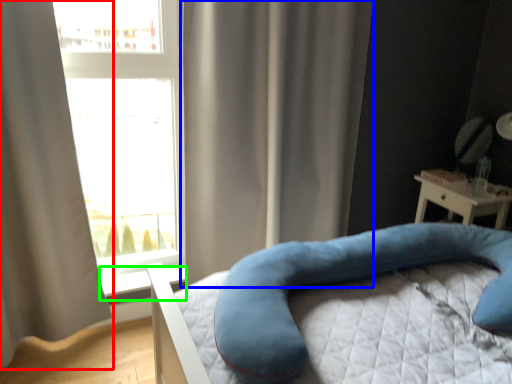
Question: Considering the real-world distances, which object is farthest from curtain (highlighted by a red box)? curtain (highlighted by a blue box) or window sill (highlighted by a green box)?

Choices:
 (A) curtain
 (B) window sill

Answer: (A)